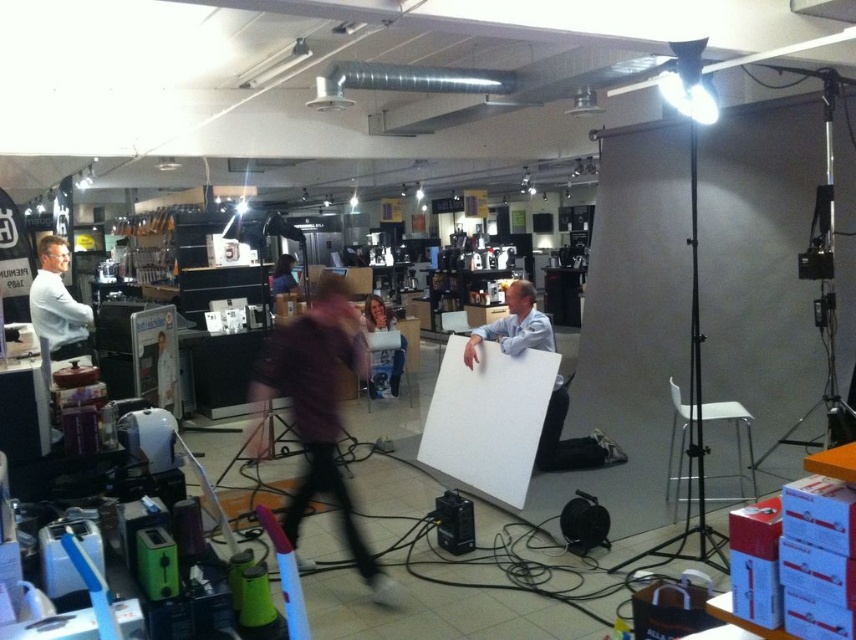
Question: Among these points, which one is farthest from the camera?

Choices:
 (A) (376, 316)
 (B) (40, 326)
 (C) (290, 396)
 (D) (563, 448)

Answer: (A)

Question: Is purple fabric at center to the left of dark purple fabric at center from the viewer's perspective?

Choices:
 (A) no
 (B) yes

Answer: (A)

Question: Which object is positioned closest to the matte purple shirt at center?

Choices:
 (A) white shirt at left
 (B) purple fabric at center

Answer: (A)

Question: Is purple fabric at center behind dark purple fabric at center?

Choices:
 (A) no
 (B) yes

Answer: (A)

Question: Which point is farther to the camera?

Choices:
 (A) (330, 467)
 (B) (271, 292)
 (C) (61, 326)
 (D) (396, 396)

Answer: (B)

Question: Does matte purple shirt at center have a larger size compared to dark purple fabric at center?

Choices:
 (A) yes
 (B) no

Answer: (A)